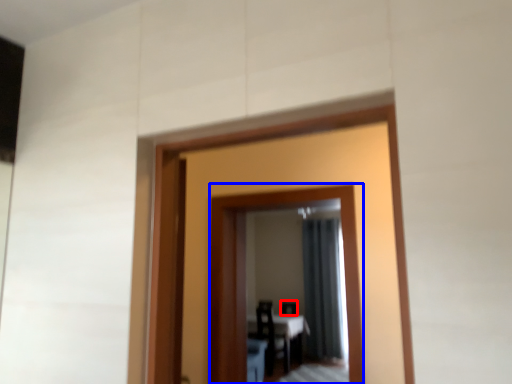
Question: Which of the following is the farthest to the observer, chair (highlighted by a red box) or mirror (highlighted by a blue box)?

Choices:
 (A) chair
 (B) mirror

Answer: (A)